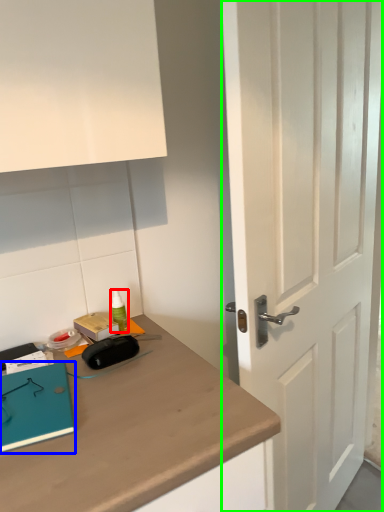
Question: Estimate the real-world distances between objects in this image. Which object is farther from stationery (highlighted by a red box), notebook (highlighted by a blue box) or door (highlighted by a green box)?

Choices:
 (A) notebook
 (B) door

Answer: (B)